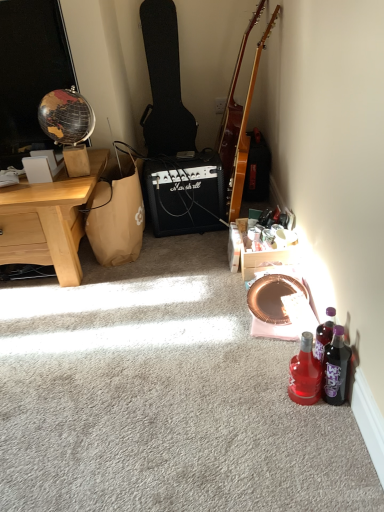
Question: Can you confirm if wooden crate at lower right is smaller than glossy wood guitar at upper right, the first guitar in the right-to-left sequence?

Choices:
 (A) yes
 (B) no

Answer: (A)

Question: Considering the relative sizes of wooden crate at lower right and glossy wood guitar at upper right, the first guitar in the right-to-left sequence, in the image provided, is wooden crate at lower right shorter than glossy wood guitar at upper right, the first guitar in the right-to-left sequence,?

Choices:
 (A) no
 (B) yes

Answer: (B)

Question: From the image's perspective, is wooden crate at lower right under glossy wood guitar at upper right, which appears as the second guitar when viewed from the left?

Choices:
 (A) no
 (B) yes

Answer: (B)

Question: From a real-world perspective, is wooden crate at lower right physically above glossy wood guitar at upper right, which appears as the second guitar when viewed from the left?

Choices:
 (A) yes
 (B) no

Answer: (B)

Question: Would you say wooden crate at lower right contains glossy wood guitar at upper right, which appears as the second guitar when viewed from the left?

Choices:
 (A) no
 (B) yes

Answer: (A)

Question: Considering the positions of black textured guitar case at center-left, arranged as the 1th guitar when viewed from the left, and wooden crate at lower right in the image, is black textured guitar case at center-left, arranged as the 1th guitar when viewed from the left, bigger or smaller than wooden crate at lower right?

Choices:
 (A) small
 (B) big

Answer: (B)

Question: Is point (150, 4) positioned closer to the camera than point (243, 249)?

Choices:
 (A) closer
 (B) farther

Answer: (B)

Question: From the image's perspective, is black textured guitar case at center-left, which is counted as the 2th guitar, starting from the right, positioned above or below wooden crate at lower right?

Choices:
 (A) below
 (B) above

Answer: (B)

Question: In terms of width, does black textured guitar case at center-left, which is counted as the 2th guitar, starting from the right, look wider or thinner when compared to wooden crate at lower right?

Choices:
 (A) wide
 (B) thin

Answer: (B)

Question: Considering the positions of black plastic marshall amplifier at center and brown paper bag at left in the image, is black plastic marshall amplifier at center wider or thinner than brown paper bag at left?

Choices:
 (A) thin
 (B) wide

Answer: (B)

Question: Is black plastic marshall amplifier at center taller or shorter than brown paper bag at left?

Choices:
 (A) short
 (B) tall

Answer: (A)

Question: From a real-world perspective, relative to brown paper bag at left, is black plastic marshall amplifier at center vertically above or below?

Choices:
 (A) below
 (B) above

Answer: (A)

Question: In the image, is black plastic marshall amplifier at center positioned in front of or behind brown paper bag at left?

Choices:
 (A) behind
 (B) front

Answer: (A)

Question: Considering the positions of light brown wood desk at left and translucent purple bottle at lower right, the second bottle positioned from the left, in the image, is light brown wood desk at left taller or shorter than translucent purple bottle at lower right, the second bottle positioned from the left,?

Choices:
 (A) short
 (B) tall

Answer: (B)

Question: Considering the positions of point (18, 186) and point (340, 344), is point (18, 186) closer or farther from the camera than point (340, 344)?

Choices:
 (A) closer
 (B) farther

Answer: (B)